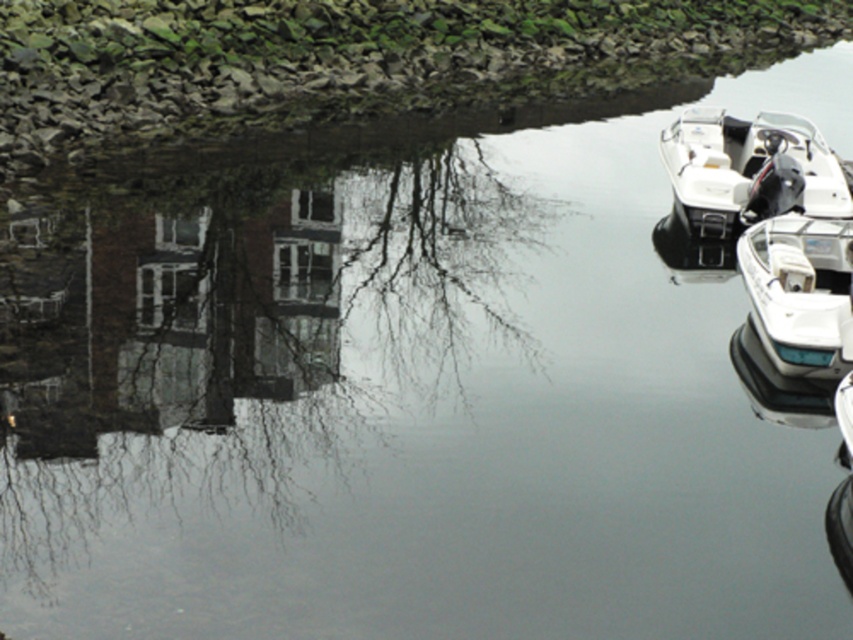
Between point (799, 196) and point (827, 326), which one is positioned in front?

Point (827, 326)

Can you confirm if white plastic boat at right is positioned below white glossy boat at right?

Incorrect, white plastic boat at right is not positioned below white glossy boat at right.

Locate an element on the screen. This screenshot has width=853, height=640. white plastic boat at right is located at coordinates (746, 166).